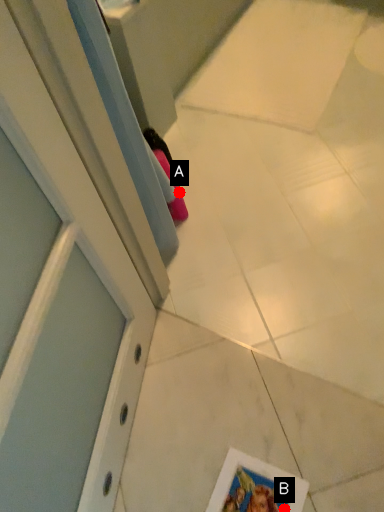
Question: Two points are circled on the image, labeled by A and B beside each circle. Among these points, which one is nearest to the camera?

Choices:
 (A) A is closer
 (B) B is closer

Answer: (B)